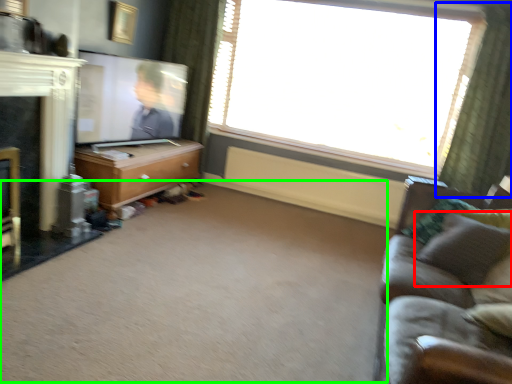
Question: Estimate the real-world distances between objects in this image. Which object is closer to pillow (highlighted by a red box), curtain (highlighted by a blue box) or plain (highlighted by a green box)?

Choices:
 (A) curtain
 (B) plain

Answer: (B)